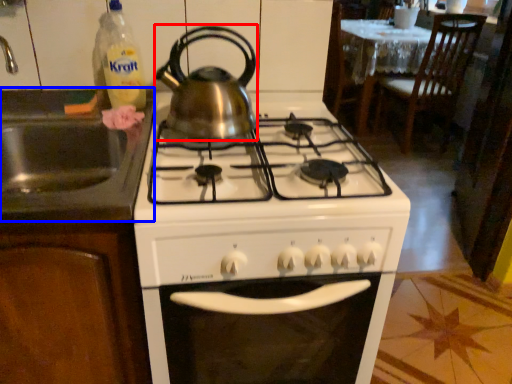
Question: Among these objects, which one is farthest to the camera, kitchen appliance (highlighted by a red box) or sink (highlighted by a blue box)?

Choices:
 (A) kitchen appliance
 (B) sink

Answer: (A)